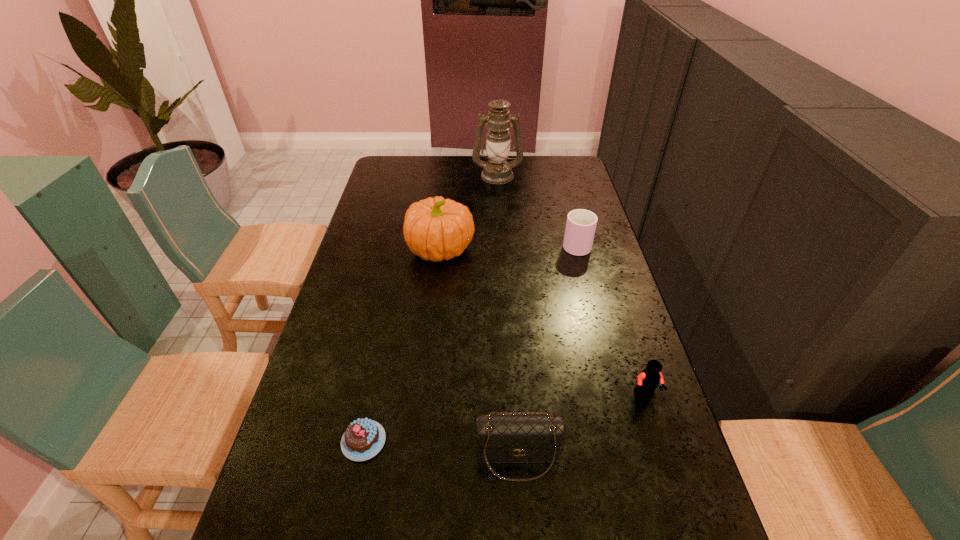
This screenshot has width=960, height=540. In the image, there is a desktop. What are the coordinates of `vacant space at the right edge` in the screenshot? It's located at (590, 280).

Find the location of `vacant area at the far left corner`. vacant area at the far left corner is located at coordinates (414, 176).

Locate an element on the screen. The image size is (960, 540). free space at the far right corner of the desktop is located at coordinates (549, 169).

The width and height of the screenshot is (960, 540). Find the location of `unoccupied position between the cup and the chocolate cake`. unoccupied position between the cup and the chocolate cake is located at coordinates (469, 342).

This screenshot has width=960, height=540. What are the coordinates of `vacant area that lies between the farthest object and the clutch bag` in the screenshot? It's located at (507, 316).

Identify the location of unoccupied area between the oil lamp and the third nearest object. (571, 285).

Image resolution: width=960 pixels, height=540 pixels. I want to click on free space between the tallest object and the chocolate cake, so click(x=430, y=308).

This screenshot has width=960, height=540. Identify the location of vacant area that lies between the clutch bag and the oil lamp. (507, 316).

Where is `free space between the shortest object and the clutch bag`? The height and width of the screenshot is (540, 960). free space between the shortest object and the clutch bag is located at coordinates (441, 449).

At what (x,y) coordinates should I click in order to perform the action: click on vacant point located between the clutch bag and the fifth shortest object. Please return your answer as a coordinate pair (x, y). This screenshot has height=540, width=960. Looking at the image, I should click on (479, 353).